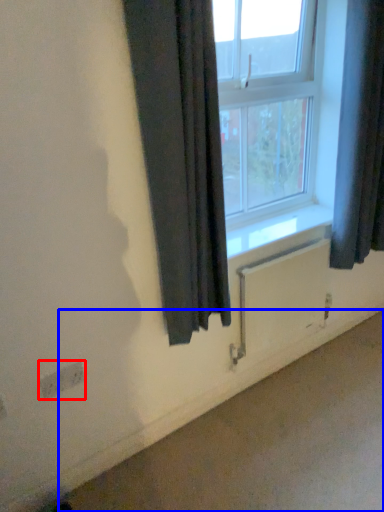
Question: Which point is further to the camera, electric outlet (highlighted by a red box) or concrete (highlighted by a blue box)?

Choices:
 (A) electric outlet
 (B) concrete

Answer: (A)